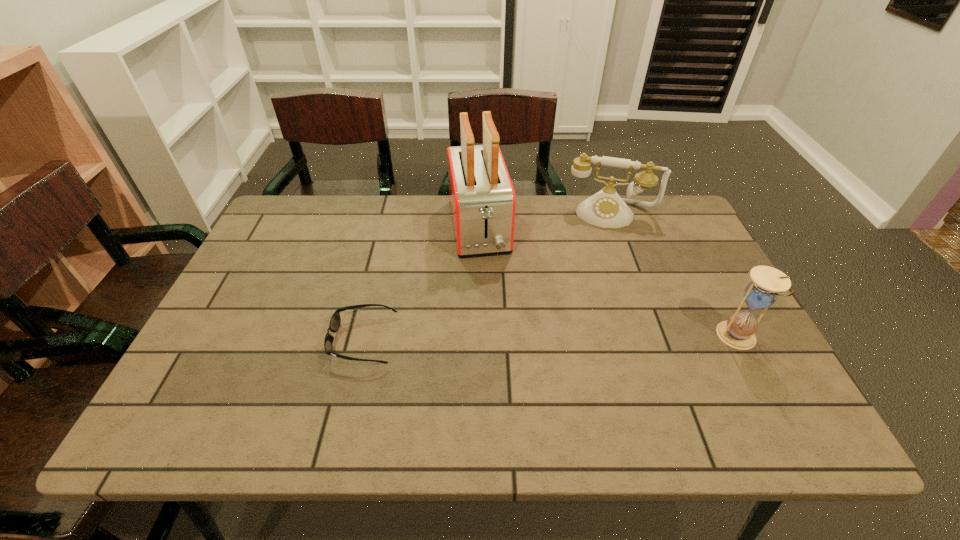
Where is `free spot between the hourglass and the telephone`? The height and width of the screenshot is (540, 960). free spot between the hourglass and the telephone is located at coordinates point(674,276).

Find the location of a particular element. The height and width of the screenshot is (540, 960). free space between the shortest object and the second object from right to left is located at coordinates (487, 276).

In order to click on vacant space that's between the third object from left to right and the tallest object in this screenshot , I will do `click(545, 221)`.

This screenshot has width=960, height=540. In order to click on vacant region between the shortest object and the telephone in this screenshot , I will do `click(487, 276)`.

Locate an element on the screen. free spot between the rightmost object and the toaster is located at coordinates (609, 283).

At what (x,y) coordinates should I click in order to perform the action: click on free spot between the telephone and the sunglasses. Please return your answer as a coordinate pair (x, y). Looking at the image, I should click on (487, 276).

Identify the location of free space between the telephone and the sunglasses. (487, 276).

Find the location of `free space between the toaster and the third object from left to right`. free space between the toaster and the third object from left to right is located at coordinates (545, 221).

This screenshot has width=960, height=540. Identify the location of object that can be found as the second closest to the second object from right to left. pos(738,331).

At what (x,y) coordinates should I click in order to perform the action: click on the closest object to the rightmost object. Please return your answer as a coordinate pair (x, y). The height and width of the screenshot is (540, 960). Looking at the image, I should click on (606, 209).